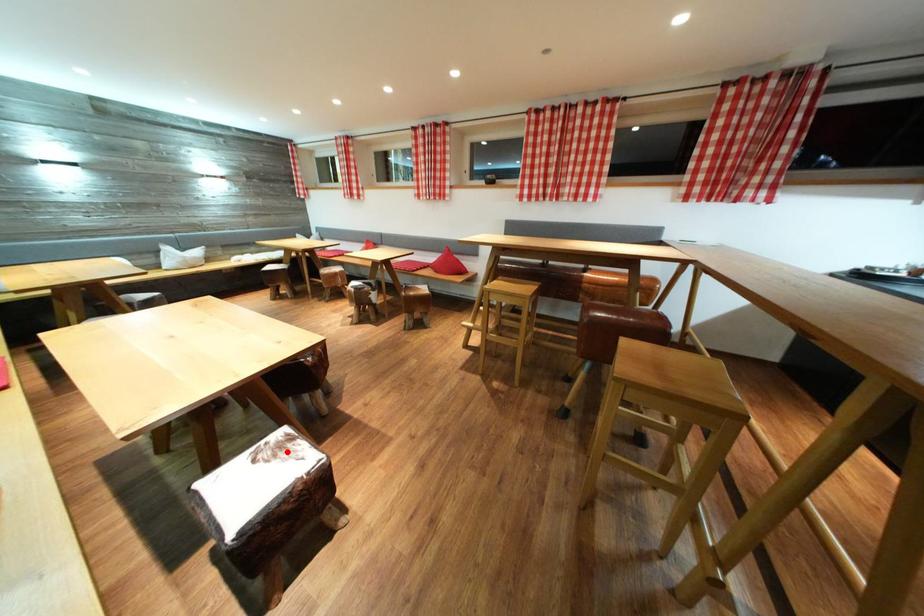
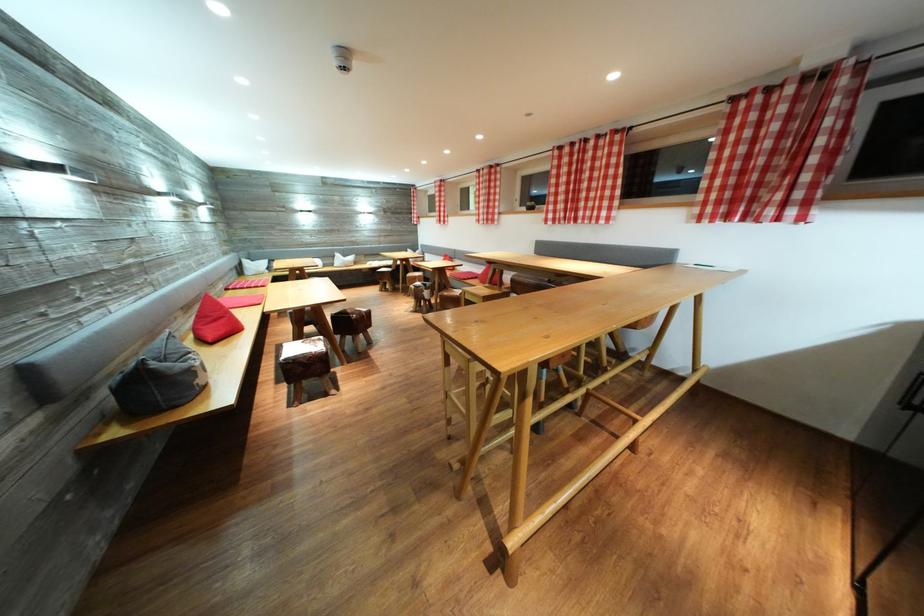
Question: I am providing you with two images of the same scene from different viewpoints. Image1 has a red point marked. In image2, the corresponding 3D location appears at what relative position? Reply with the corresponding letter.

Choices:
 (A) Closer
 (B) Farther

Answer: (A)